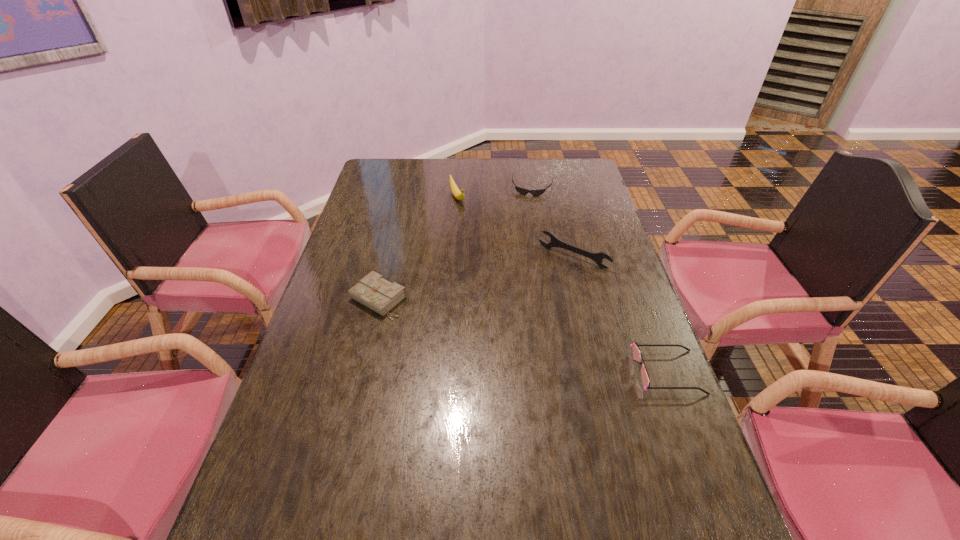
This screenshot has height=540, width=960. Find the location of `vacant space on the desktop that is between the diary and the nearest object and is positioned at the stem of the second object from left to right`. vacant space on the desktop that is between the diary and the nearest object and is positioned at the stem of the second object from left to right is located at coordinates (549, 342).

Find the location of a particular element. The image size is (960, 540). vacant space on the desktop that is between the second nearest object and the nearer sunglasses and is positioned on the open ends of the wrench is located at coordinates (512, 333).

The width and height of the screenshot is (960, 540). I want to click on vacant space on the desktop that is between the fourth farthest object and the nearer sunglasses and is positioned on the front-facing side of the shorter sunglasses, so click(502, 330).